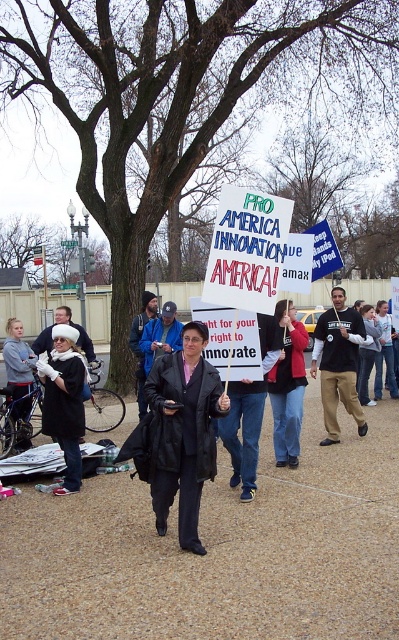
Question: Which point appears farthest from the camera in this image?

Choices:
 (A) (294, 346)
 (B) (331, 380)

Answer: (B)

Question: Is white fur hat at left bigger than dark gray cotton hoodie at center?

Choices:
 (A) yes
 (B) no

Answer: (B)

Question: In this image, where is dark gray cotton hoodie at center located relative to matte black jacket at center?

Choices:
 (A) right
 (B) left

Answer: (A)

Question: Which point appears closest to the camera in this image?

Choices:
 (A) (19, 387)
 (B) (343, 396)
 (C) (288, 346)

Answer: (C)

Question: Which of the following is the closest to the observer?

Choices:
 (A) (274, 365)
 (B) (53, 356)

Answer: (B)

Question: Does matte black jacket at center appear over dark gray hoodie at center?

Choices:
 (A) yes
 (B) no

Answer: (B)